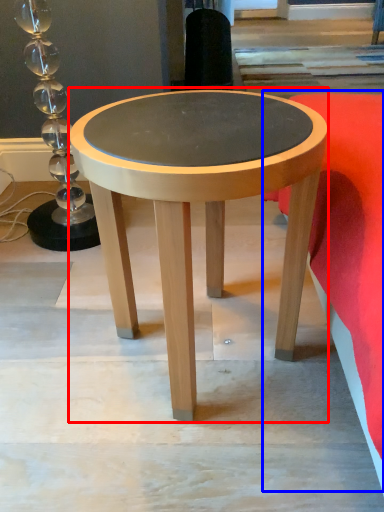
Question: Which object appears farthest to the camera in this image, coffee table (highlighted by a red box) or bedding (highlighted by a blue box)?

Choices:
 (A) coffee table
 (B) bedding

Answer: (A)